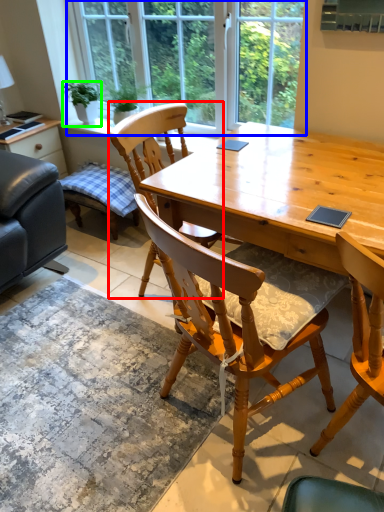
Question: Based on their relative distances, which object is nearer to chair (highlighted by a red box)? Choose from window (highlighted by a blue box) and houseplant (highlighted by a green box).

Choices:
 (A) window
 (B) houseplant

Answer: (A)